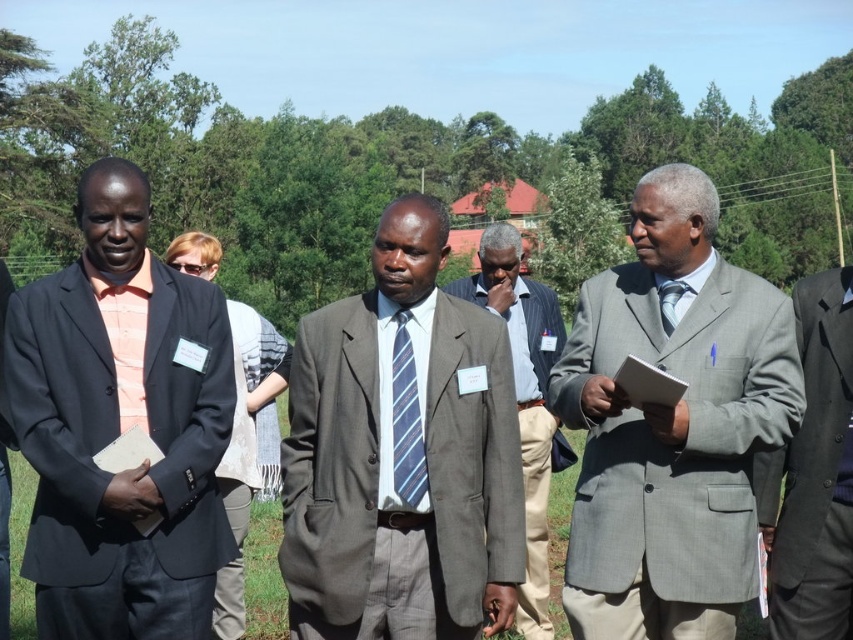
Question: Which of the following is the farthest from the observer?

Choices:
 (A) matte gray suit at center
 (B) blue striped tie at center
 (C) matte black suit at left

Answer: (B)

Question: Based on their relative distances, which object is farther from the matte black suit at left?

Choices:
 (A) matte gray suit at center
 (B) blue striped tie at center

Answer: (B)

Question: Which point appears closest to the camera in this image?

Choices:
 (A) (680, 296)
 (B) (810, 374)

Answer: (A)

Question: Is gray suit at center closer to camera compared to light blue striped tie at center?

Choices:
 (A) yes
 (B) no

Answer: (B)

Question: Does matte gray suit at center appear on the right side of light blue striped tie at center?

Choices:
 (A) yes
 (B) no

Answer: (B)

Question: Can you confirm if gray wool suit at right is positioned below light blue striped tie at center?

Choices:
 (A) yes
 (B) no

Answer: (A)